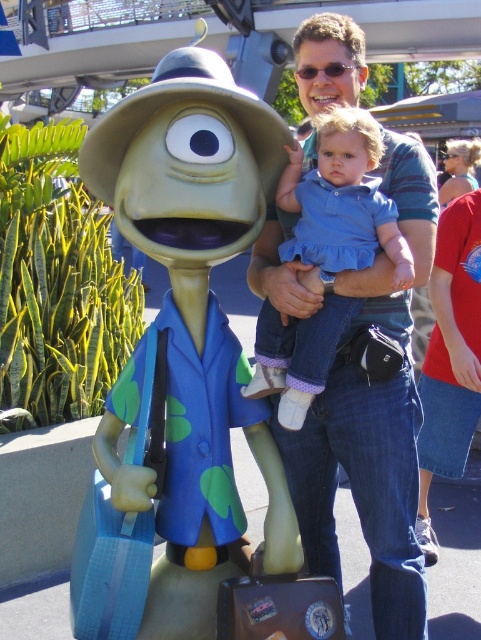
Who is positioned more to the right, denim jeans at center or denim dress at center?

denim jeans at center

Describe the element at coordinates (354, 433) in the screenshot. I see `denim jeans at center` at that location.

Locate an element on the screen. denim jeans at center is located at coordinates (354, 433).

Between matte green plastic alien at center and denim jeans at center, which one has less height?

Standing shorter between the two is matte green plastic alien at center.

Which is more to the left, matte green plastic alien at center or denim jeans at center?

From the viewer's perspective, matte green plastic alien at center appears more on the left side.

Describe the element at coordinates (197, 321) in the screenshot. I see `matte green plastic alien at center` at that location.

Where is `matte green plastic alien at center`? The image size is (481, 640). matte green plastic alien at center is located at coordinates tap(197, 321).

Can you confirm if matte green plastic alien at center is thinner than denim dress at center?

No, matte green plastic alien at center is not thinner than denim dress at center.

Does point (231, 394) come farther from viewer compared to point (265, 374)?

No, (231, 394) is closer to viewer.

Identify the location of matte green plastic alien at center. The image size is (481, 640). (197, 321).